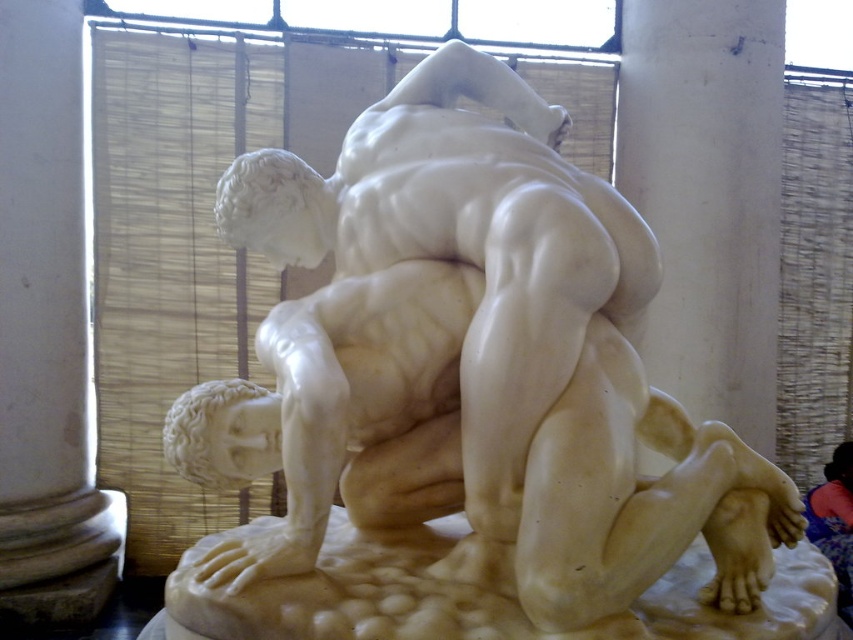
Can you confirm if white marble statue at center is shorter than white marble pillar at left?

Yes.

Is white marble statue at center thinner than white marble pillar at left?

No, white marble statue at center is not thinner than white marble pillar at left.

At what (x,y) coordinates should I click in order to perform the action: click on white marble statue at center. Please return your answer as a coordinate pair (x, y). The image size is (853, 640). Looking at the image, I should click on (473, 362).

Does white marble statue at center appear on the right side of white marble at center?

In fact, white marble statue at center is to the left of white marble at center.

Is point (256, 192) closer to camera compared to point (463, 525)?

Yes.

Is point (451, 512) positioned before point (450, 529)?

Yes, point (451, 512) is closer to viewer.

The image size is (853, 640). In order to click on white marble statue at center in this screenshot , I will do `click(473, 362)`.

Who is positioned more to the left, white marble pillar at left or white marble at center?

Positioned to the left is white marble pillar at left.

Is white marble pillar at left thinner than white marble at center?

Correct, white marble pillar at left's width is less than white marble at center's.

Is point (4, 381) farther from viewer compared to point (688, 632)?

Yes, point (4, 381) is farther from viewer.

Where is `white marble pillar at left`? This screenshot has height=640, width=853. white marble pillar at left is located at coordinates (45, 330).